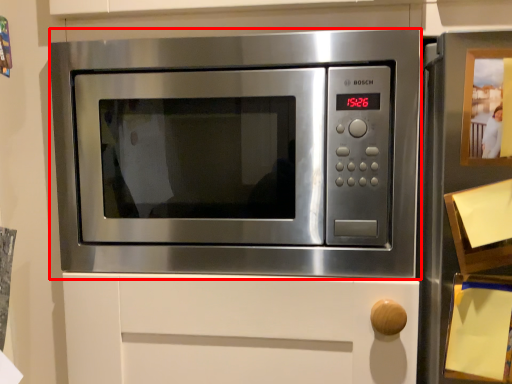
Question: In this image, where is microwave oven (annotated by the red box) located relative to button?

Choices:
 (A) right
 (B) left

Answer: (B)